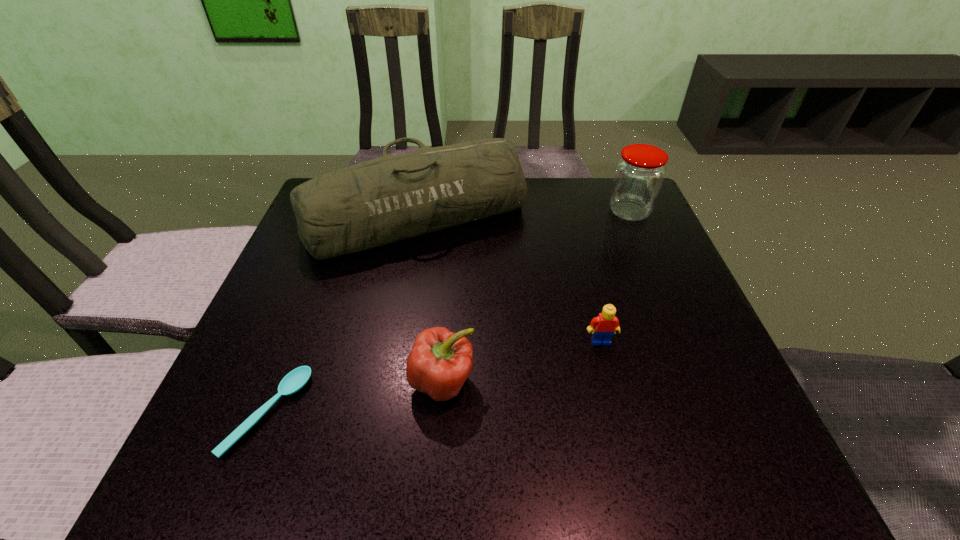
Locate an element on the screen. This screenshot has width=960, height=540. free space at the far edge is located at coordinates (577, 183).

The image size is (960, 540). In order to click on blank space at the near edge of the desktop in this screenshot , I will do `click(363, 441)`.

This screenshot has width=960, height=540. I want to click on free spot at the left edge of the desktop, so click(x=247, y=384).

The height and width of the screenshot is (540, 960). In the image, there is a desktop. What are the coordinates of `vacant space at the right edge` in the screenshot? It's located at (649, 325).

Locate an element on the screen. vacant area at the near left corner is located at coordinates (272, 479).

I want to click on vacant area at the far right corner, so click(588, 188).

Locate an element on the screen. This screenshot has width=960, height=540. vacant area that lies between the rightmost object and the duffel bag is located at coordinates (523, 214).

Locate an element on the screen. The height and width of the screenshot is (540, 960). free space between the third farthest object and the bell pepper is located at coordinates (521, 361).

At what (x,y) coordinates should I click in order to perform the action: click on empty space that is in between the spoon and the duffel bag. Please return your answer as a coordinate pair (x, y). Looking at the image, I should click on (343, 315).

Where is `free space between the spoon and the bell pepper`? free space between the spoon and the bell pepper is located at coordinates (355, 397).